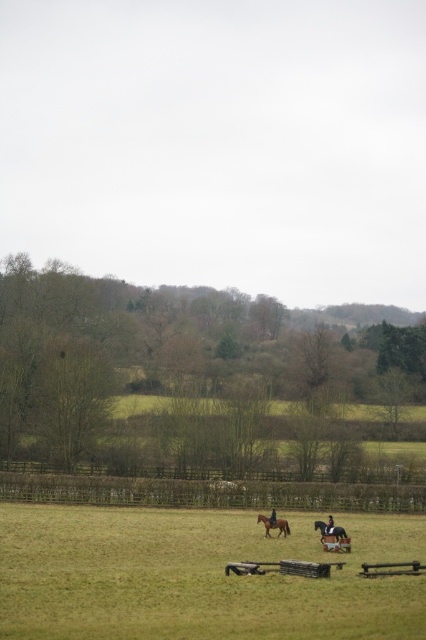
Is point (340, 538) positioned before point (325, 532)?

Yes, point (340, 538) is closer to viewer.

Between shiny brown horse at center and shiny black jacket at center, which one has less height?

shiny black jacket at center

Is point (331, 540) farther from camera compared to point (327, 528)?

No, it is not.

This screenshot has height=640, width=426. I want to click on shiny brown horse at center, so click(330, 531).

Who is more forward, [270,529] or [331,516]?

Point [331,516] is in front.

How distant is brown glossy horse at center from shiny black jacket at center?

brown glossy horse at center and shiny black jacket at center are 1.68 meters apart.

Is point (267, 528) positioned before point (333, 520)?

No.

The image size is (426, 640). What are the coordinates of `brown glossy horse at center` in the screenshot? It's located at (273, 525).

Which is behind, point (282, 528) or point (271, 524)?

The point (282, 528) is more distant.

Is the position of brown glossy horse at center less distant than that of dark brown leather jacket at center?

Yes, it is in front of dark brown leather jacket at center.

This screenshot has height=640, width=426. Identify the location of brown glossy horse at center. (273, 525).